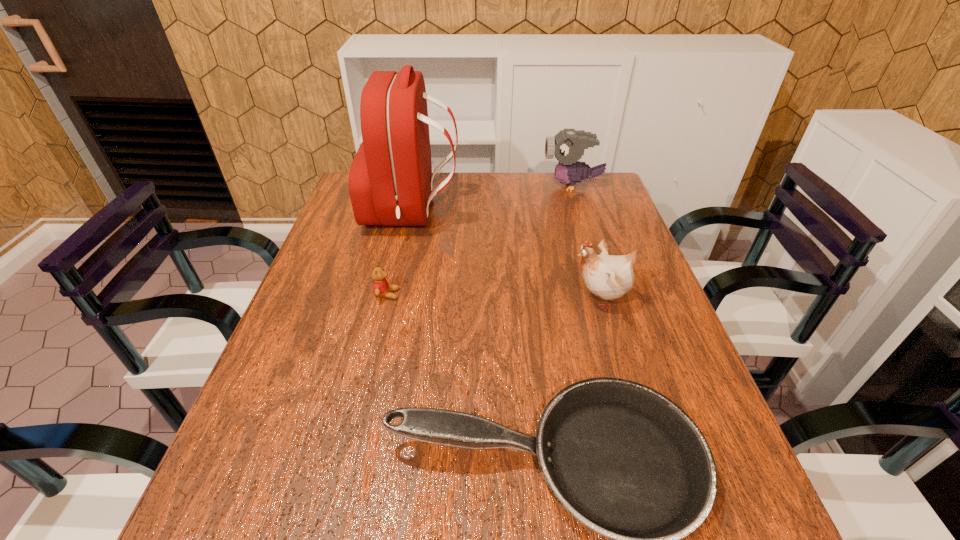
I want to click on the tallest object, so click(x=390, y=181).

The image size is (960, 540). What are the coordinates of `the farther bird` in the screenshot? It's located at (568, 146).

At what (x,y) coordinates should I click in order to perform the action: click on the nearer bird. Please return your answer as a coordinate pair (x, y). The width and height of the screenshot is (960, 540). Looking at the image, I should click on (609, 277).

Locate an element on the screen. teddy bear is located at coordinates [x=381, y=288].

In order to click on free space located 0.200m on the strap side of the tallest object in this screenshot , I will do `click(523, 213)`.

Where is `vacant area situated at the beak of the farther bird`? This screenshot has height=540, width=960. vacant area situated at the beak of the farther bird is located at coordinates (460, 186).

Locate an element on the screen. vacant space located 0.330m at the beak of the farther bird is located at coordinates (445, 186).

Locate an element on the screen. This screenshot has width=960, height=540. vacant position located at the beak of the farther bird is located at coordinates (525, 186).

This screenshot has height=540, width=960. I want to click on vacant space positioned 0.200m at the beak of the nearer bird, so click(488, 299).

At what (x,y) coordinates should I click in order to perform the action: click on free location located 0.370m at the beak of the nearer bird. Please return your answer as a coordinate pair (x, y). Looking at the image, I should click on [419, 299].